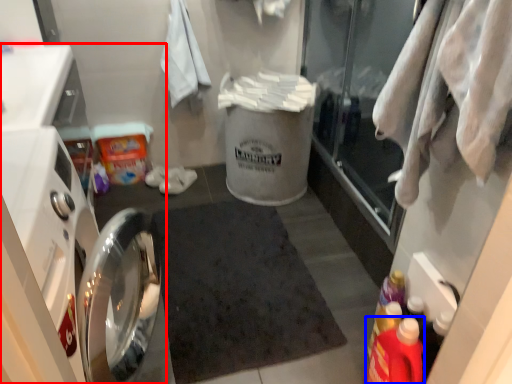
Question: Which object is further to the camera taking this photo, dish washer (highlighted by a red box) or bottle (highlighted by a blue box)?

Choices:
 (A) dish washer
 (B) bottle

Answer: (B)